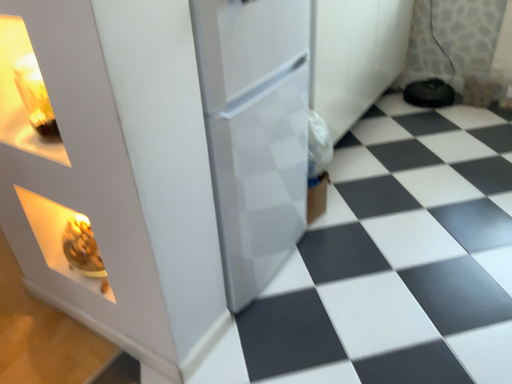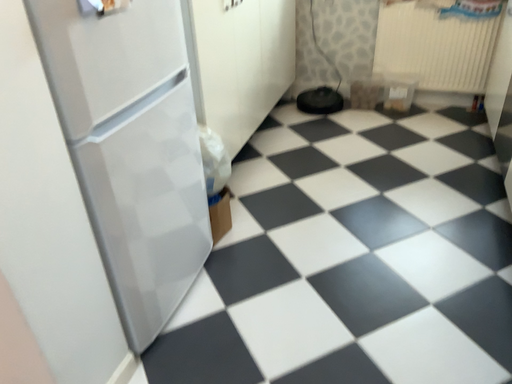
Question: How did the camera likely rotate when shooting the video?

Choices:
 (A) rotated right
 (B) rotated left

Answer: (A)